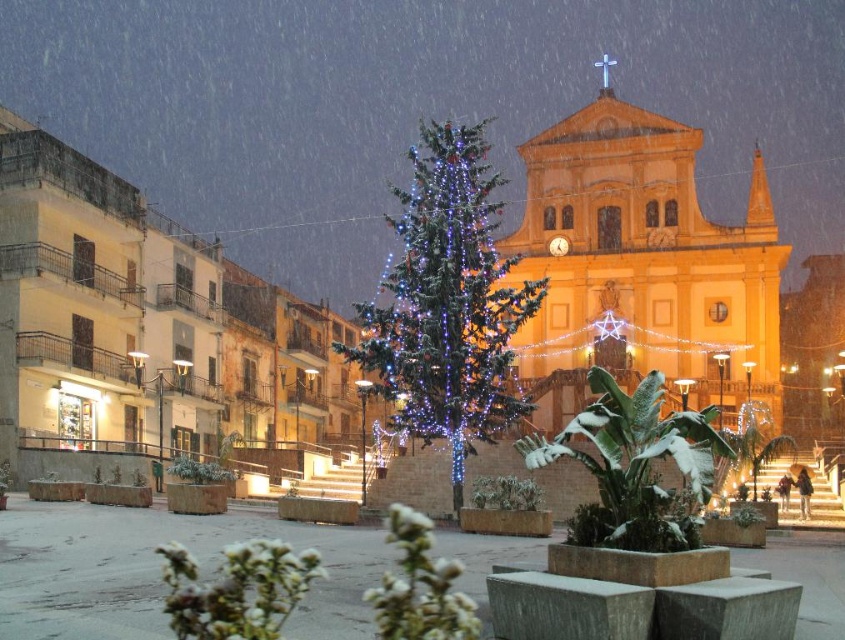
Question: Is illuminated green pine at center thinner than white snowy plant at center?

Choices:
 (A) yes
 (B) no

Answer: (B)

Question: Among these points, which one is farthest from the camera?

Choices:
 (A) (439, 346)
 (B) (642, 422)

Answer: (A)

Question: Which object appears closest to the camera in this image?

Choices:
 (A) illuminated green pine at center
 (B) white snowy plant at center

Answer: (B)

Question: Is illuminated green pine at center closer to the viewer compared to white snowy plant at center?

Choices:
 (A) yes
 (B) no

Answer: (B)

Question: Is illuminated green pine at center to the right of white snowy plant at center from the viewer's perspective?

Choices:
 (A) no
 (B) yes

Answer: (A)